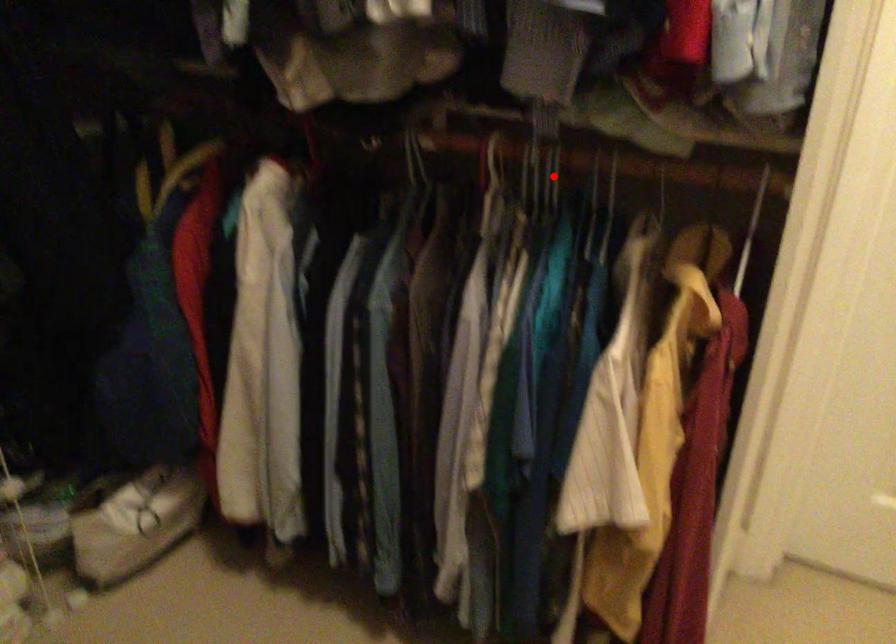
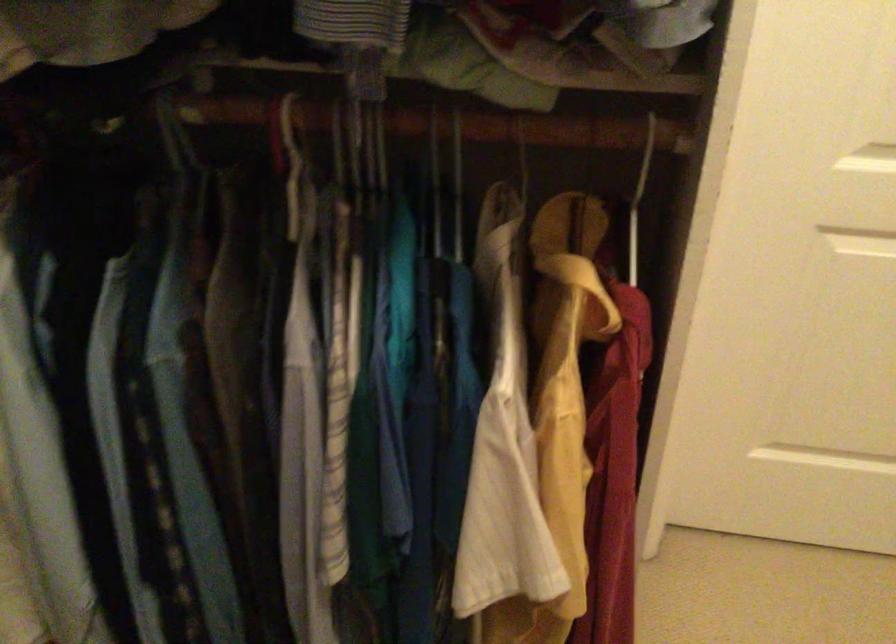
Find the pixel in the second image that matches the highlighted location in the first image.

(378, 149)